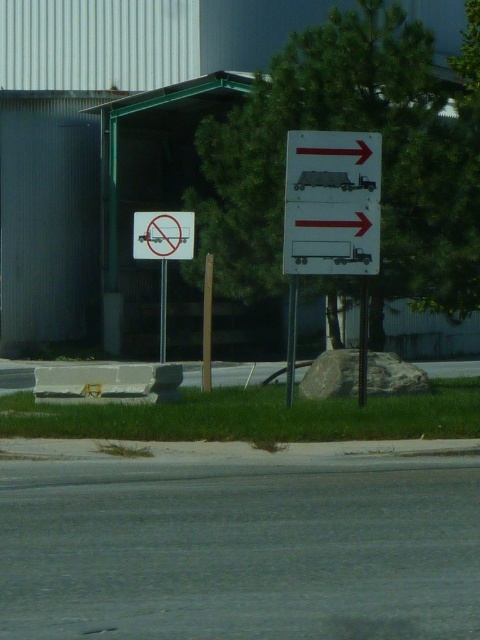
Question: Does matte white truck at upper right appear over brushed metal pole at left?

Choices:
 (A) yes
 (B) no

Answer: (A)

Question: Does white plastic sign at center come behind metallic pole at center?

Choices:
 (A) no
 (B) yes

Answer: (B)

Question: Which of the following is the closest to the observer?

Choices:
 (A) white plastic sign at center
 (B) brushed metal pole at left
 (C) matte white truck at upper right

Answer: (C)

Question: Which point is farther to the camera?

Choices:
 (A) (162, 358)
 (B) (324, 148)
 (C) (288, 344)

Answer: (A)

Question: Which of these objects is positioned farthest from the matte white truck at upper right?

Choices:
 (A) white plastic sign at center
 (B) metallic pole at center

Answer: (A)

Question: Does matte white truck at upper right have a greater width compared to brushed metal pole at left?

Choices:
 (A) no
 (B) yes

Answer: (B)